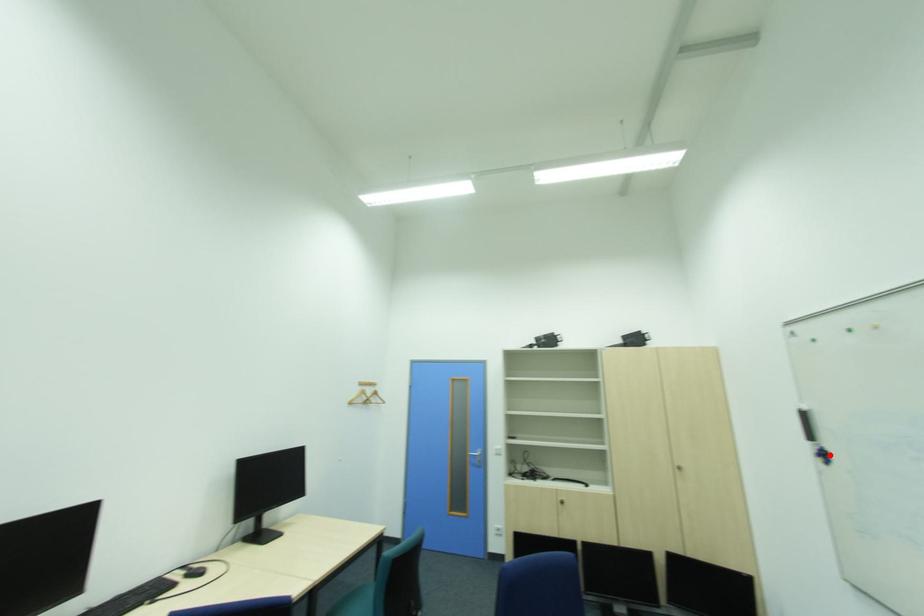
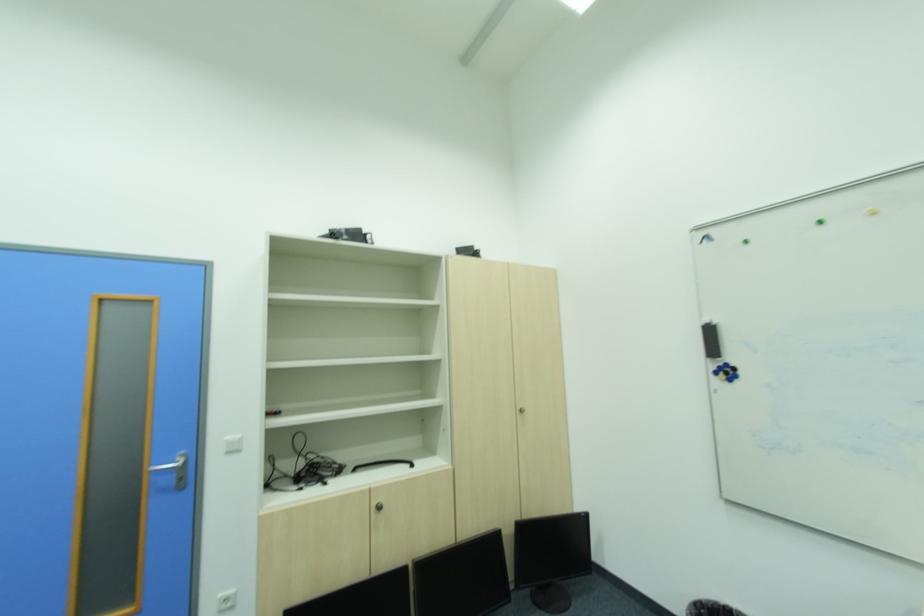
Where in the second image is the point corresponding to the highlighted location from the first image?

(736, 371)